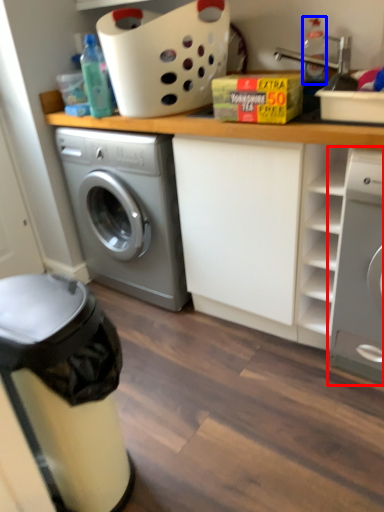
Question: Which of the following is the closest to the observer, washing machine (highlighted by a red box) or bottle (highlighted by a blue box)?

Choices:
 (A) washing machine
 (B) bottle

Answer: (A)